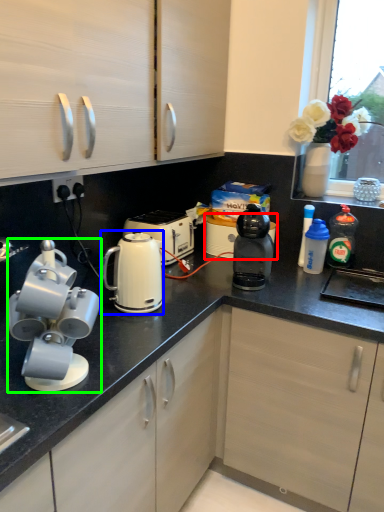
Question: Estimate the real-world distances between objects in this image. Which object is farther from appliance (highlighted by a red box), kitchen appliance (highlighted by a blue box) or home appliance (highlighted by a green box)?

Choices:
 (A) kitchen appliance
 (B) home appliance

Answer: (B)